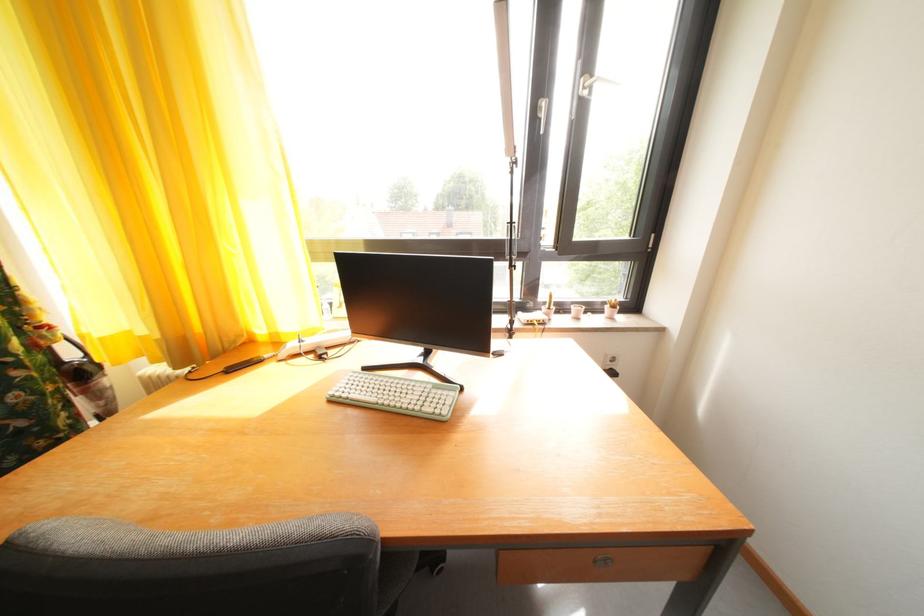
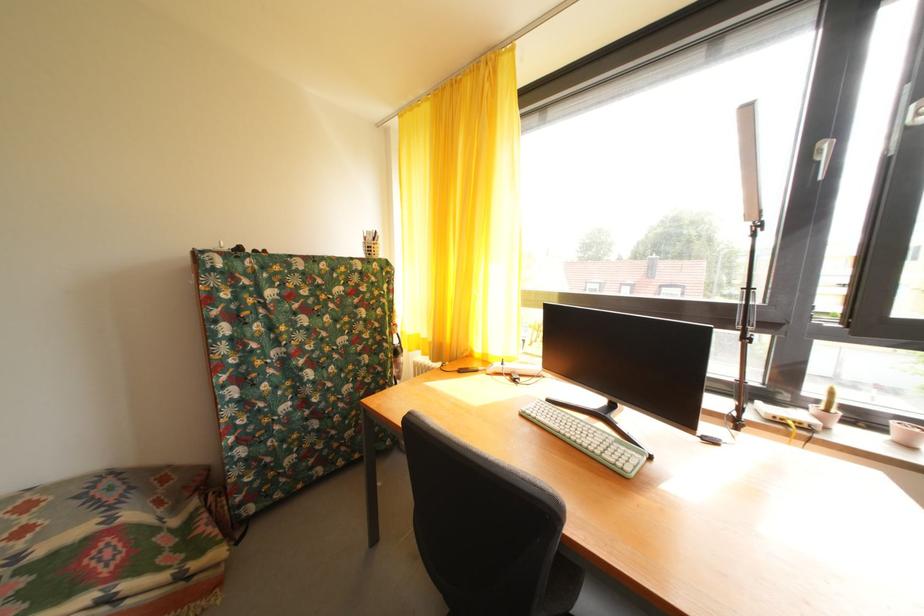
Locate, in the second image, the point that corresponds to point (529, 320) in the first image.

(768, 408)